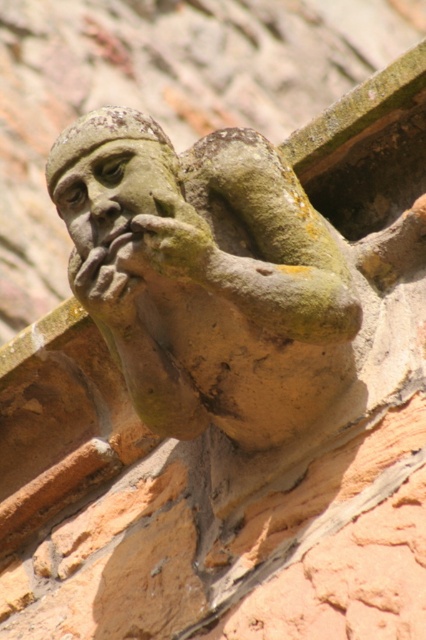
Is point (186, 237) less distant than point (97, 288)?

Yes.

Measure the distance from green mossy hand at center to stone textured hand at center.

green mossy hand at center is 36.56 inches from stone textured hand at center.

Which is in front, point (204, 241) or point (115, 326)?

Point (204, 241) is more forward.

I want to click on green mossy hand at center, so pyautogui.click(x=180, y=243).

Image resolution: width=426 pixels, height=640 pixels. What do you see at coordinates (112, 189) in the screenshot? I see `stone statue head at center` at bounding box center [112, 189].

Is stone statue head at center to the right of green mossy hand at center from the viewer's perspective?

In fact, stone statue head at center is to the left of green mossy hand at center.

Does point (166, 148) lie in front of point (178, 198)?

No, it is behind (178, 198).

Locate an element on the screen. This screenshot has width=426, height=640. stone statue head at center is located at coordinates (112, 189).

Can you confirm if stone gargoyle at center is positioned above green mossy hand at center?

No.

Which is in front, point (123, 205) or point (172, 216)?

Point (172, 216) is in front.

Find the location of `stone gargoyle at center`. stone gargoyle at center is located at coordinates (204, 276).